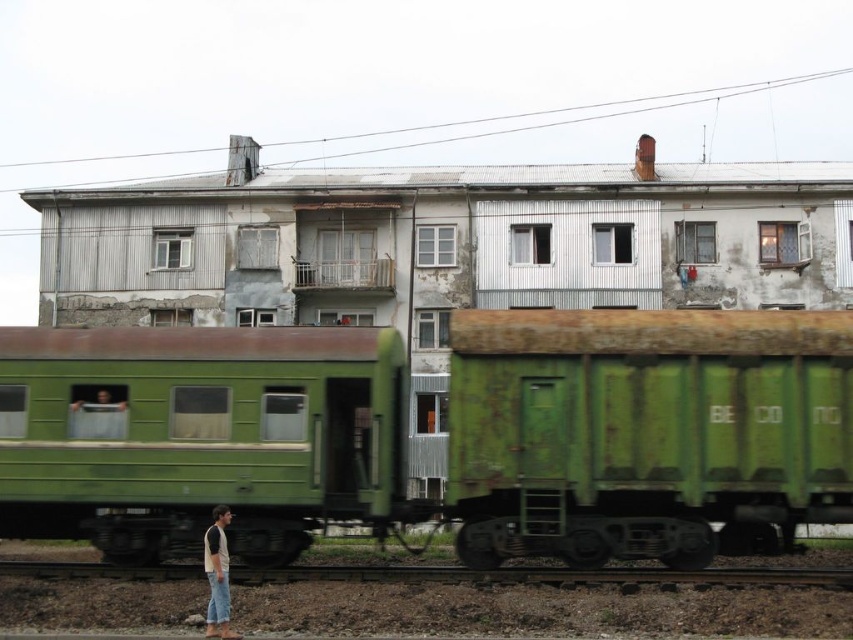
Question: Which point is closer to the camera taking this photo?

Choices:
 (A) (637, 396)
 (B) (271, 570)
 (C) (210, 579)

Answer: (C)

Question: Which of the following is the closest to the observer?

Choices:
 (A) (244, 577)
 (B) (103, 410)
 (C) (115, 525)

Answer: (A)

Question: Is smooth metal train track at lower center closer to camera compared to denim jeans at lower left?

Choices:
 (A) yes
 (B) no

Answer: (B)

Question: Can you confirm if green matte train car at left is smaller than smooth metal train track at lower center?

Choices:
 (A) no
 (B) yes

Answer: (B)

Question: Based on their relative distances, which object is nearer to the green matte train car at left?

Choices:
 (A) green matte train car at center
 (B) rusty green metal train car at center
 (C) denim jeans at lower left
 (D) smooth green fabric at left

Answer: (A)

Question: Can you confirm if rusty green metal train car at center is wider than smooth metal train track at lower center?

Choices:
 (A) no
 (B) yes

Answer: (A)